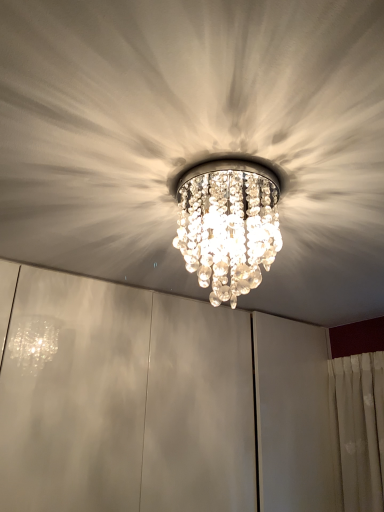
The image size is (384, 512). Describe the element at coordinates (228, 224) in the screenshot. I see `clear crystal chandelier at center` at that location.

Locate an element on the screen. The height and width of the screenshot is (512, 384). clear crystal chandelier at center is located at coordinates (228, 224).

This screenshot has height=512, width=384. What do you see at coordinates (196, 138) in the screenshot?
I see `clear crystal chandelier at center` at bounding box center [196, 138].

This screenshot has height=512, width=384. I want to click on clear crystal chandelier at center, so click(x=196, y=138).

This screenshot has width=384, height=512. I want to click on clear crystal chandelier at center, so click(x=228, y=224).

Is clear crystal chandelier at center to the right of clear crystal chandelier at center from the viewer's perspective?

Incorrect, clear crystal chandelier at center is not on the right side of clear crystal chandelier at center.

Which object is more forward, clear crystal chandelier at center or clear crystal chandelier at center?

Positioned in front is clear crystal chandelier at center.

Considering the positions of points (274, 248) and (23, 234), is point (274, 248) farther from camera compared to point (23, 234)?

That is False.

From the image's perspective, is clear crystal chandelier at center over clear crystal chandelier at center?

Yes, from the image's perspective, clear crystal chandelier at center is over clear crystal chandelier at center.

From a real-world perspective, between clear crystal chandelier at center and clear crystal chandelier at center, who is vertically lower?

From a 3D spatial view, clear crystal chandelier at center is below.

Which object is thinner, clear crystal chandelier at center or clear crystal chandelier at center?

Thinner between the two is clear crystal chandelier at center.

Between clear crystal chandelier at center and clear crystal chandelier at center, which one has less height?

clear crystal chandelier at center is shorter.

Can you confirm if clear crystal chandelier at center is smaller than clear crystal chandelier at center?

Yes, clear crystal chandelier at center is smaller than clear crystal chandelier at center.

Is clear crystal chandelier at center located outside clear crystal chandelier at center?

Indeed, clear crystal chandelier at center is completely outside clear crystal chandelier at center.

Are clear crystal chandelier at center and clear crystal chandelier at center beside each other?

No, clear crystal chandelier at center is not next to clear crystal chandelier at center.

Is clear crystal chandelier at center facing away from clear crystal chandelier at center?

No, clear crystal chandelier at center is not facing away from clear crystal chandelier at center.

What's the angular difference between clear crystal chandelier at center and clear crystal chandelier at center's facing directions?

176 degrees separate the facing orientations of clear crystal chandelier at center and clear crystal chandelier at center.

What are the coordinates of `fan located in front of the clear crystal chandelier at center` in the screenshot? It's located at (196, 138).

Considering the positions of objects clear crystal chandelier at center and clear crystal chandelier at center in the image provided, who is more to the right, clear crystal chandelier at center or clear crystal chandelier at center?

clear crystal chandelier at center is more to the right.

In the image, is clear crystal chandelier at center positioned in front of or behind clear crystal chandelier at center?

clear crystal chandelier at center is in front of clear crystal chandelier at center.

Does point (50, 58) appear closer or farther from the camera than point (273, 179)?

Point (50, 58).

From the image's perspective, which one is positioned lower, clear crystal chandelier at center or clear crystal chandelier at center?

clear crystal chandelier at center, from the image's perspective.

From a real-world perspective, which is physically above, clear crystal chandelier at center or clear crystal chandelier at center?

clear crystal chandelier at center, from a real-world perspective.

Considering the sizes of objects clear crystal chandelier at center and clear crystal chandelier at center in the image provided, who is thinner, clear crystal chandelier at center or clear crystal chandelier at center?

clear crystal chandelier at center is thinner.

Between clear crystal chandelier at center and clear crystal chandelier at center, which one has more height?

clear crystal chandelier at center is taller.

Looking at the image, does clear crystal chandelier at center seem bigger or smaller compared to clear crystal chandelier at center?

Clearly, clear crystal chandelier at center is larger in size than clear crystal chandelier at center.

Which is correct: clear crystal chandelier at center is inside clear crystal chandelier at center, or outside of it?

clear crystal chandelier at center cannot be found inside clear crystal chandelier at center.

Is clear crystal chandelier at center placed right next to clear crystal chandelier at center?

No, clear crystal chandelier at center is not next to clear crystal chandelier at center.

Could you tell me if clear crystal chandelier at center is turned towards clear crystal chandelier at center?

No, clear crystal chandelier at center is not oriented towards clear crystal chandelier at center.

How far apart are clear crystal chandelier at center and clear crystal chandelier at center?

A distance of 18.29 centimeters exists between clear crystal chandelier at center and clear crystal chandelier at center.

Where is `lamp that appears on the left of clear crystal chandelier at center`? lamp that appears on the left of clear crystal chandelier at center is located at coordinates (228, 224).

Locate an element on the screen. The height and width of the screenshot is (512, 384). fan below the clear crystal chandelier at center (from the image's perspective) is located at coordinates (196, 138).

Locate an element on the screen. lamp on the left of clear crystal chandelier at center is located at coordinates (228, 224).